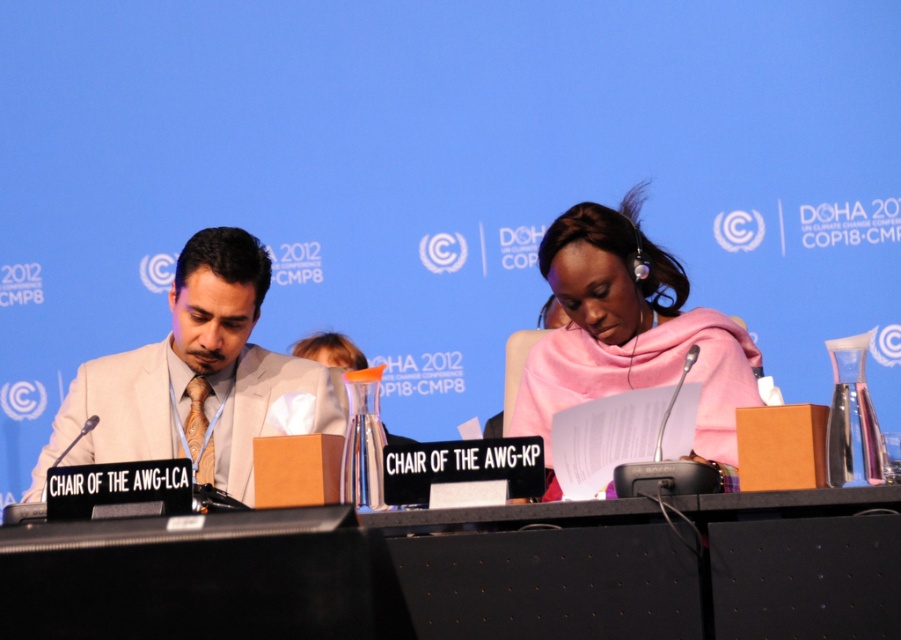
Is point (554, 515) farther from camera compared to point (730, 324)?

No, (554, 515) is in front of (730, 324).

Between point (729, 609) and point (697, 406), which one is positioned in front?

Point (729, 609) is in front.

Locate an element on the screen. black plastic table at center is located at coordinates (647, 566).

In order to click on white satin suit at center in this screenshot , I will do `click(196, 378)`.

Does white satin suit at center have a greater height compared to pink fabric scarf at center?

No, white satin suit at center is not taller than pink fabric scarf at center.

Is point (71, 458) closer to viewer compared to point (734, 435)?

No.

The image size is (901, 640). I want to click on white satin suit at center, so click(x=196, y=378).

What do you see at coordinates (647, 566) in the screenshot? This screenshot has height=640, width=901. I see `black plastic table at center` at bounding box center [647, 566].

Is point (825, 541) positioned before point (202, 458)?

That is True.

Measure the distance between point (626,577) and camera.

2.33 meters

You are a GUI agent. You are given a task and a screenshot of the screen. Output one action in this format:
    pyautogui.click(x=<x>, y=<y>)
    Task: Click on the black plastic table at center
    
    Given the screenshot: What is the action you would take?
    pyautogui.click(x=647, y=566)